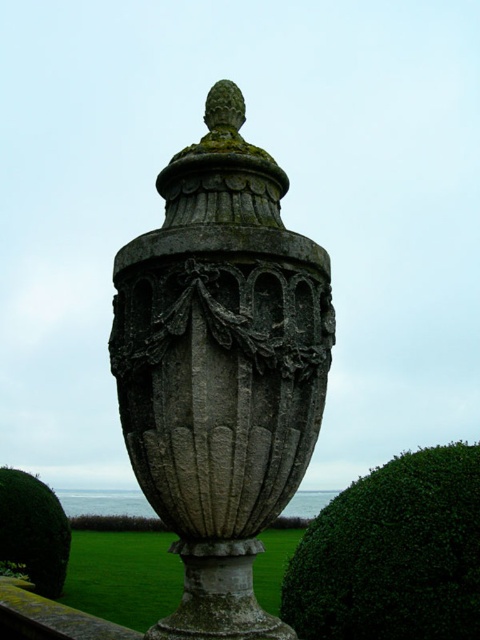
Can you confirm if gray stone urn at center is thinner than green leafy bush at lower left?

In fact, gray stone urn at center might be wider than green leafy bush at lower left.

Is gray stone urn at center positioned in front of green leafy bush at lower left?

Yes, it is.

Between point (115, 298) and point (2, 548), which one is positioned in front?

Point (115, 298) is in front.

The width and height of the screenshot is (480, 640). Find the location of `gray stone urn at center`. gray stone urn at center is located at coordinates (220, 368).

Between green leafy bush at lower right and green leafy bush at lower left, which one has less height?

Standing shorter between the two is green leafy bush at lower right.

Does green leafy bush at lower right appear on the left side of green leafy bush at lower left?

Incorrect, green leafy bush at lower right is not on the left side of green leafy bush at lower left.

Does point (348, 577) lie behind point (24, 492)?

No.

This screenshot has height=640, width=480. Find the location of `green leafy bush at lower right`. green leafy bush at lower right is located at coordinates (393, 554).

Which is behind, point (118, 346) or point (356, 538)?

Positioned behind is point (356, 538).

Who is more distant from viewer, [184,321] or [320,602]?

The point [320,602] is behind.

Locate an element on the screen. gray stone urn at center is located at coordinates (220, 368).